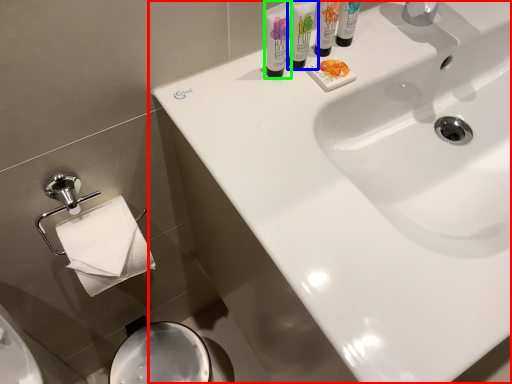
Question: Which is farther away from sink (highlighted by a red box)? shaving cream (highlighted by a blue box) or shaving cream (highlighted by a green box)?

Choices:
 (A) shaving cream
 (B) shaving cream

Answer: (B)